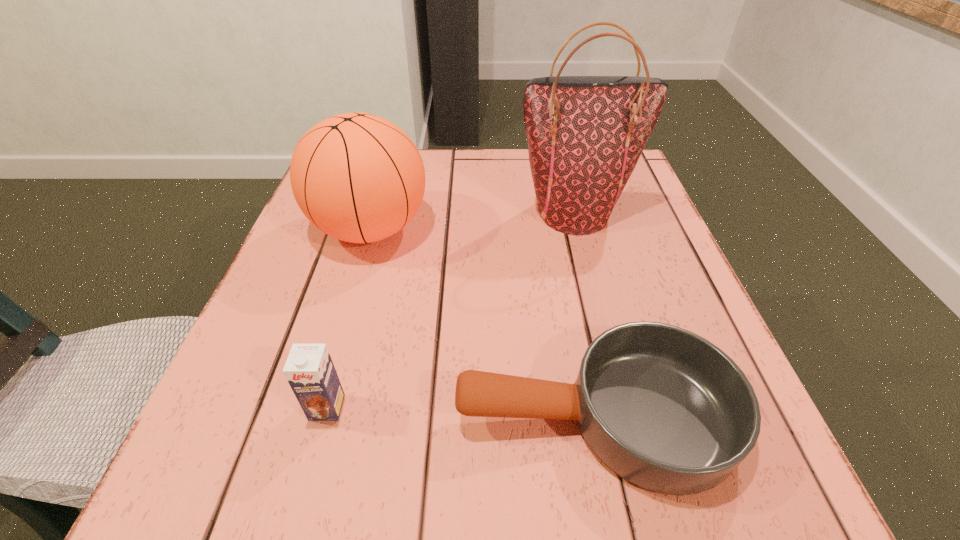
This screenshot has height=540, width=960. Identify the location of vacant space that is in between the handbag and the basketball. point(472,220).

At what (x,y) coordinates should I click in order to perform the action: click on vacant space that is in between the handbag and the second shortest object. Please return your answer as a coordinate pair (x, y). The width and height of the screenshot is (960, 540). Looking at the image, I should click on (450, 310).

Identify the location of free point between the tallest object and the second tallest object. (472, 220).

At what (x,y) coordinates should I click in order to perform the action: click on object that ranks as the closest to the third shortest object. Please return your answer as a coordinate pair (x, y). Looking at the image, I should click on (585, 134).

Find the location of `object that is the closest to the tallest object`. object that is the closest to the tallest object is located at coordinates (357, 177).